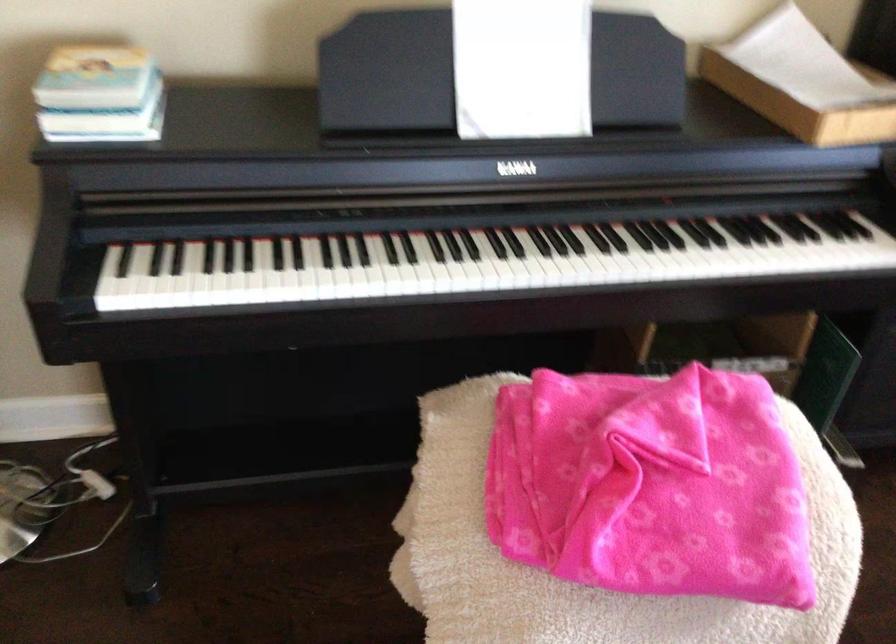
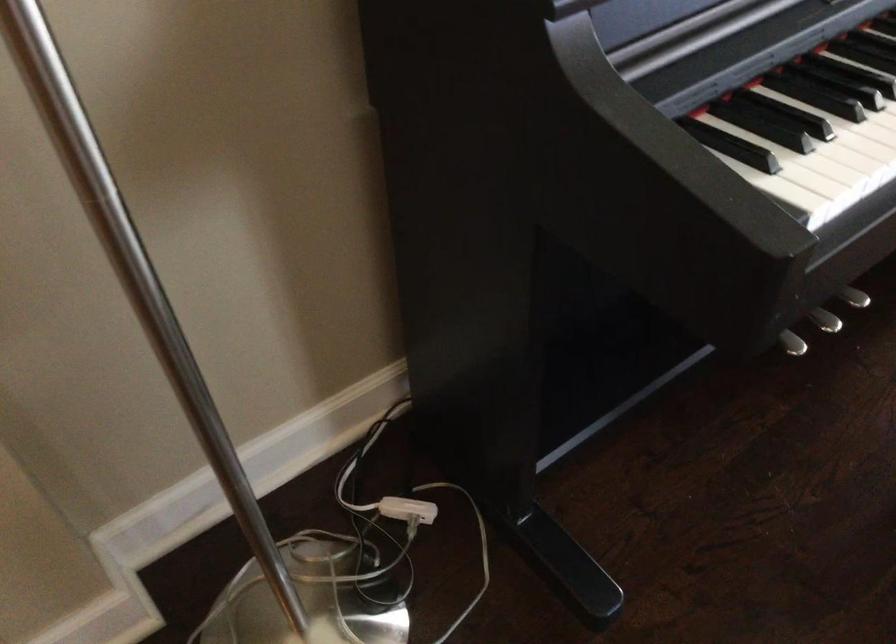
Find the pixel in the second image that matches point 200,257 in the first image.

(799, 100)